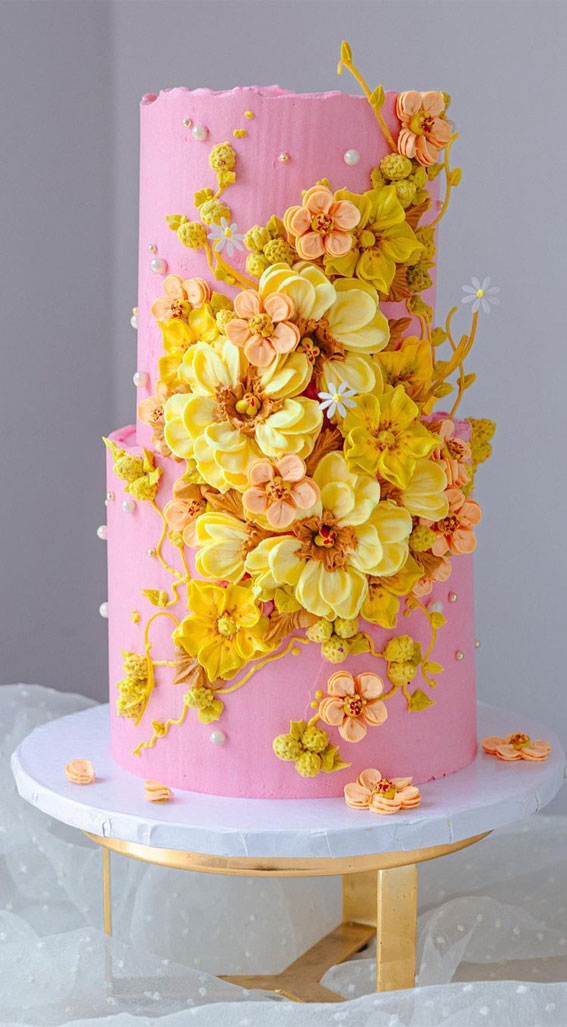
Locate an element on the screen. corner of back wall and side wall is located at coordinates (111, 411), (114, 349), (110, 282), (113, 237), (112, 196), (116, 124), (112, 70), (112, 17).